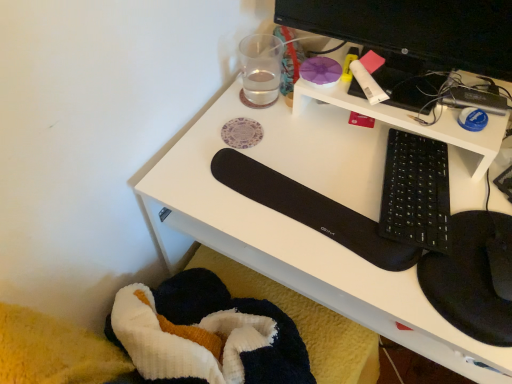
The width and height of the screenshot is (512, 384). What do you see at coordinates (260, 69) in the screenshot?
I see `transparent glass at upper center, which is the 2th stationery from right to left` at bounding box center [260, 69].

The height and width of the screenshot is (384, 512). I want to click on black matte keyboard at center-right, so click(304, 225).

Image resolution: width=512 pixels, height=384 pixels. What do you see at coordinates (416, 192) in the screenshot?
I see `black matte keyboard at center-right` at bounding box center [416, 192].

Where is `black glossy monitor at upper right`? black glossy monitor at upper right is located at coordinates (415, 28).

In the scene shown: Considering the sizes of objects black glossy monitor at upper right and transparent glass at upper center, which is the 2th stationery from right to left, in the image provided, who is shorter, black glossy monitor at upper right or transparent glass at upper center, which is the 2th stationery from right to left,?

Standing shorter between the two is transparent glass at upper center, which is the 2th stationery from right to left.

Is black glossy monitor at upper right far away from transparent glass at upper center, the 1th stationery from the back?

No, black glossy monitor at upper right is not far away from transparent glass at upper center, the 1th stationery from the back.

Considering the positions of objects black glossy monitor at upper right and transparent glass at upper center, which ranks as the second stationery in front-to-back order, in the image provided, who is more to the right, black glossy monitor at upper right or transparent glass at upper center, which ranks as the second stationery in front-to-back order,?

Positioned to the right is black glossy monitor at upper right.

Is black glossy monitor at upper right wider or thinner than transparent glass at upper center, which is the 2th stationery from right to left?

Considering their sizes, black glossy monitor at upper right looks slimmer than transparent glass at upper center, which is the 2th stationery from right to left.

From a real-world perspective, who is located higher, black matte keyboard at center-right or black glossy monitor at upper right?

black glossy monitor at upper right, from a real-world perspective.

Considering the relative positions of black matte keyboard at center-right and black glossy monitor at upper right in the image provided, is black matte keyboard at center-right behind black glossy monitor at upper right?

Yes, it is.

From the picture: Is black matte keyboard at center-right turned away from black glossy monitor at upper right?

black matte keyboard at center-right does not have its back to black glossy monitor at upper right.

The width and height of the screenshot is (512, 384). What are the coordinates of `stationery below the transparent glass at upper center, which is the 2th stationery from right to left (from the image's perspective)` in the screenshot? It's located at pos(369,77).

Is point (366, 82) farther from viewer compared to point (253, 71)?

No.

Between white matte glue stick at upper right, positioned as the 1th stationery in front-to-back order, and transparent glass at upper center, the first stationery positioned from the left, which one has smaller size?

white matte glue stick at upper right, positioned as the 1th stationery in front-to-back order, is smaller.

From the picture: Can you confirm if black matte keyboard at center-right is wider than transparent glass at upper center, which ranks as the second stationery in front-to-back order?

Indeed, black matte keyboard at center-right has a greater width compared to transparent glass at upper center, which ranks as the second stationery in front-to-back order.

Is black matte keyboard at center-right smaller than transparent glass at upper center, the 1th stationery from the back?

No.

Would you consider black matte keyboard at center-right to be distant from transparent glass at upper center, which ranks as the second stationery in front-to-back order?

No.

Measure the distance from transparent glass at upper center, which is the 2th stationery from right to left, to white matte glue stick at upper right, positioned as the first stationery in right-to-left order.

transparent glass at upper center, which is the 2th stationery from right to left, and white matte glue stick at upper right, positioned as the first stationery in right-to-left order, are 9.64 inches apart from each other.

Considering the positions of objects transparent glass at upper center, which is the 2th stationery from right to left, and white matte glue stick at upper right, which is the 2th stationery from back to front, in the image provided, who is behind, transparent glass at upper center, which is the 2th stationery from right to left, or white matte glue stick at upper right, which is the 2th stationery from back to front,?

transparent glass at upper center, which is the 2th stationery from right to left, is more distant.

Which of these two, transparent glass at upper center, the 1th stationery from the back, or white matte glue stick at upper right, positioned as the first stationery in right-to-left order, is wider?

white matte glue stick at upper right, positioned as the first stationery in right-to-left order.

From the image's perspective, between transparent glass at upper center, which ranks as the second stationery in front-to-back order, and white matte glue stick at upper right, arranged as the second stationery when viewed from the left, who is located below?

From the image's view, white matte glue stick at upper right, arranged as the second stationery when viewed from the left, is below.

Considering the relative positions of black matte keyboard at center-right and black glossy monitor at upper right in the image provided, is black matte keyboard at center-right to the left of black glossy monitor at upper right from the viewer's perspective?

In fact, black matte keyboard at center-right is to the right of black glossy monitor at upper right.

Which point is more distant from viewer, [386,310] or [480,13]?

The point [480,13] is farther from the camera.

Which object is wider, black matte keyboard at center-right or black glossy monitor at upper right?

→ black matte keyboard at center-right.

Between black matte keyboard at center-right and black glossy monitor at upper right, which one has more height?

With more height is black matte keyboard at center-right.

From the image's perspective, who appears lower, transparent glass at upper center, the 1th stationery from the back, or black matte keyboard at center-right?

black matte keyboard at center-right.

Considering the relative positions of transparent glass at upper center, the first stationery positioned from the left, and black matte keyboard at center-right in the image provided, is transparent glass at upper center, the first stationery positioned from the left, in front of black matte keyboard at center-right?

No.

Is transparent glass at upper center, which is the 2th stationery from right to left, in contact with black matte keyboard at center-right?

transparent glass at upper center, which is the 2th stationery from right to left, and black matte keyboard at center-right are clearly separated.

How far apart are transparent glass at upper center, the 1th stationery from the back, and black matte keyboard at center-right?

A distance of 10.74 inches exists between transparent glass at upper center, the 1th stationery from the back, and black matte keyboard at center-right.

This screenshot has height=384, width=512. Identify the location of the 2nd stationery to the left of the black glossy monitor at upper right, counting from the anchor's position. (260, 69).

Find the location of a particular element. computer keyboard behind the black glossy monitor at upper right is located at coordinates [416, 192].

Based on their spatial positions, is white matte glue stick at upper right, which is the 2th stationery from back to front, or black matte keyboard at center-right further from black glossy monitor at upper right?

Based on the image, black matte keyboard at center-right appears to be further to black glossy monitor at upper right.

From the image, which object appears to be nearer to black glossy monitor at upper right, black matte keyboard at center-right or transparent glass at upper center, which ranks as the second stationery in front-to-back order?

black matte keyboard at center-right is positioned closer to the anchor black glossy monitor at upper right.

When comparing their distances from black matte keyboard at center-right, does black matte keyboard at center-right or white matte glue stick at upper right, arranged as the second stationery when viewed from the left, seem further?

white matte glue stick at upper right, arranged as the second stationery when viewed from the left, lies further to black matte keyboard at center-right than the other object.

From the image, which object appears to be nearer to black matte keyboard at center-right, black matte keyboard at center-right or black glossy monitor at upper right?

black matte keyboard at center-right.

When comparing their distances from black matte keyboard at center-right, does white matte glue stick at upper right, positioned as the 1th stationery in front-to-back order, or black matte keyboard at center-right seem closer?

Based on the image, black matte keyboard at center-right appears to be nearer to black matte keyboard at center-right.

Estimate the real-world distances between objects in this image. Which object is closer to white matte glue stick at upper right, arranged as the second stationery when viewed from the left, black glossy monitor at upper right or black matte keyboard at center-right?

Among the two, black glossy monitor at upper right is located nearer to white matte glue stick at upper right, arranged as the second stationery when viewed from the left.

Estimate the real-world distances between objects in this image. Which object is closer to black matte keyboard at center-right, black glossy monitor at upper right or white matte glue stick at upper right, positioned as the 1th stationery in front-to-back order?

The object closer to black matte keyboard at center-right is white matte glue stick at upper right, positioned as the 1th stationery in front-to-back order.

When comparing their distances from black matte keyboard at center-right, does transparent glass at upper center, the first stationery positioned from the left, or black matte keyboard at center-right seem further?

transparent glass at upper center, the first stationery positioned from the left.

Image resolution: width=512 pixels, height=384 pixels. What are the coordinates of `stationery positioned between black glossy monitor at upper right and transparent glass at upper center, which ranks as the second stationery in front-to-back order, from near to far` in the screenshot? It's located at (369, 77).

In order to click on computer keyboard between black glossy monitor at upper right and black matte keyboard at center-right in the vertical direction in this screenshot , I will do `click(416, 192)`.

This screenshot has height=384, width=512. I want to click on stationery located between transparent glass at upper center, the first stationery positioned from the left, and black matte keyboard at center-right in the left-right direction, so click(x=369, y=77).

Identify the location of stationery between transparent glass at upper center, which is the 2th stationery from right to left, and black matte keyboard at center-right in the up-down direction. (369, 77).